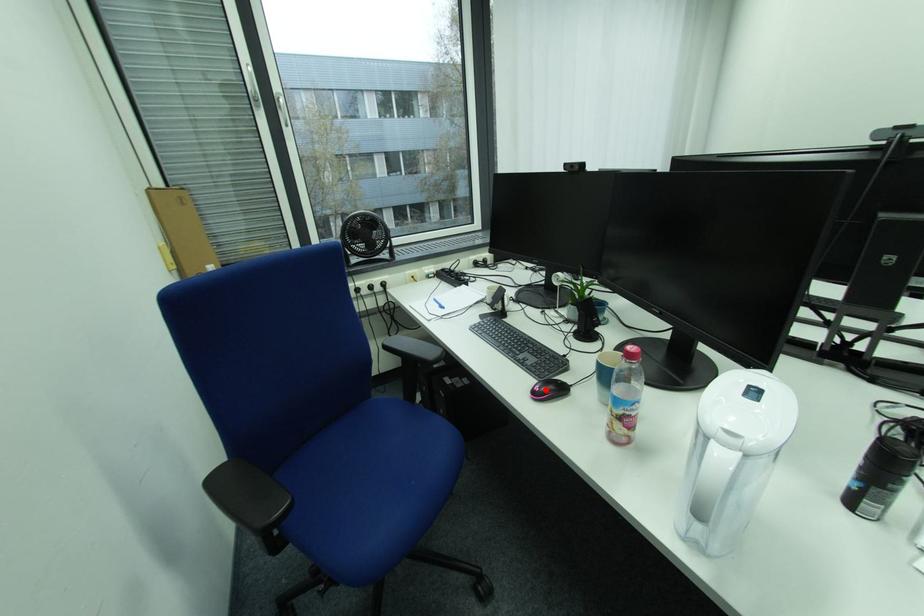
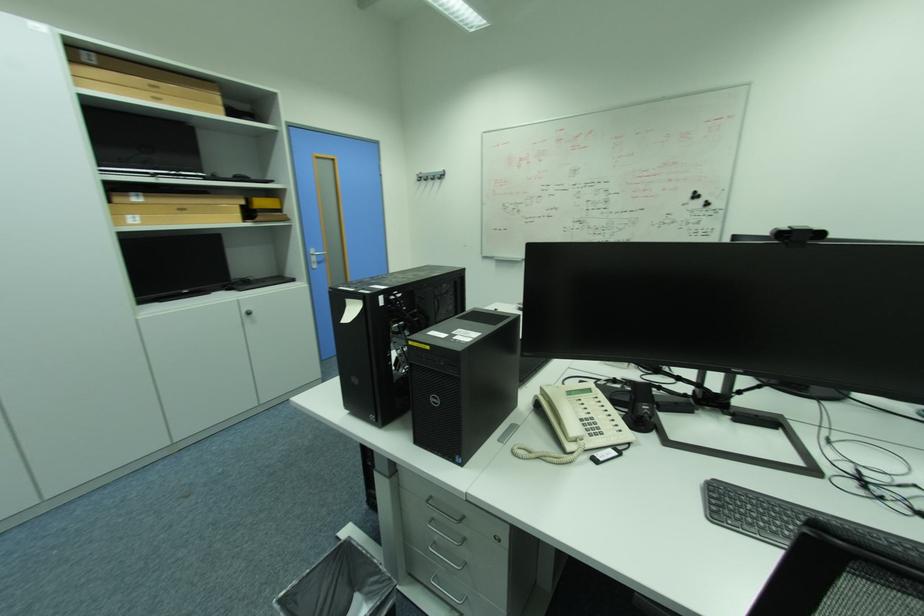
Question: I am providing you with two images of the same scene from different viewpoints. A red point is marked on the first image. At the location where the point appears in image 1, is it still visible in image 2?

Choices:
 (A) Yes
 (B) No

Answer: (B)